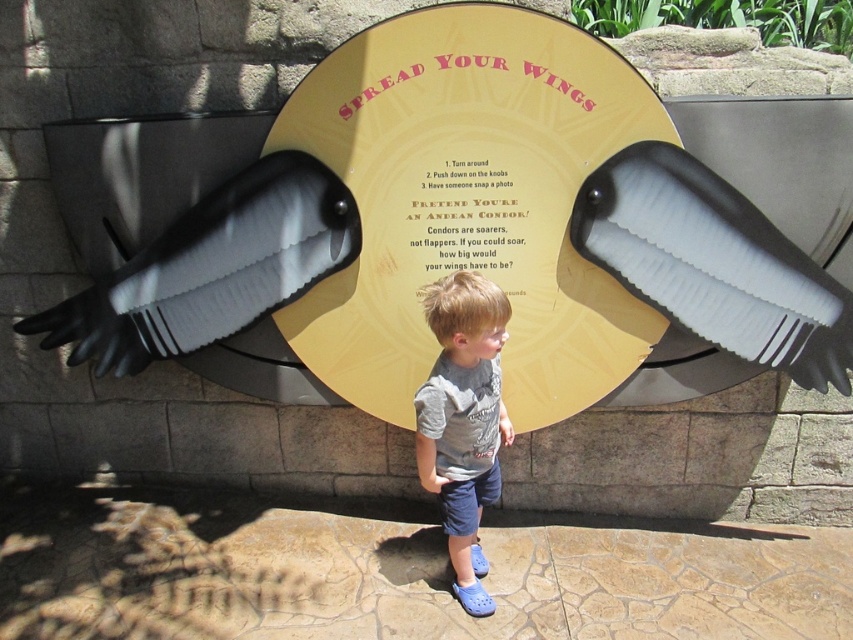
Does matte yellow sign at center have a lesser width compared to gray cotton shirt at center?

No.

How distant is matte yellow sign at center from gray cotton shirt at center?

matte yellow sign at center and gray cotton shirt at center are 15.06 inches apart.

The width and height of the screenshot is (853, 640). What are the coordinates of `matte yellow sign at center` in the screenshot? It's located at click(x=469, y=202).

You are a GUI agent. You are given a task and a screenshot of the screen. Output one action in this format:
    pyautogui.click(x=<x>, y=<y>)
    Task: Click on the matte black wing at right
    The image size is (853, 640).
    Given the screenshot: What is the action you would take?
    pyautogui.click(x=712, y=264)

Does point (815, 378) lie in front of point (434, 417)?

No, it is behind (434, 417).

Where is `matte black wing at right`? This screenshot has height=640, width=853. matte black wing at right is located at coordinates (712, 264).

Is matte yellow sign at center to the right of matte black wing at right from the viewer's perspective?

No, matte yellow sign at center is not to the right of matte black wing at right.

Is matte yellow sign at center in front of matte black wing at right?

Yes.

Locate an element on the screen. The width and height of the screenshot is (853, 640). matte yellow sign at center is located at coordinates (469, 202).